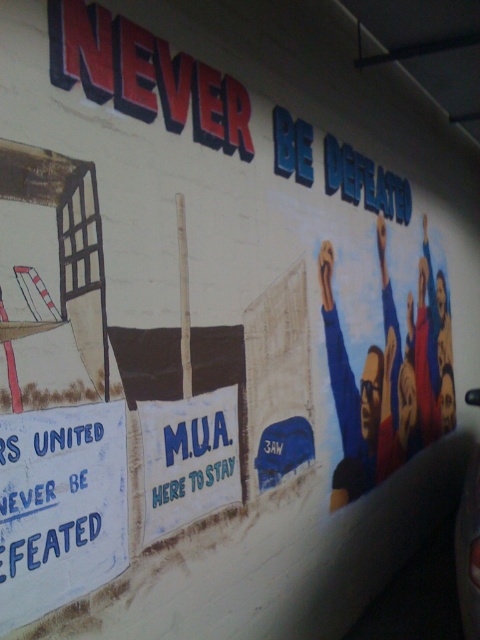
I want to click on blue painted sign at lower left, so click(x=59, y=502).

Can you confirm if blue painted sign at lower left is bigger than blue fabric sign at center?

Yes.

Which is in front, point (108, 568) or point (224, 428)?

Point (108, 568) is in front.

The image size is (480, 640). In order to click on blue painted sign at lower left in this screenshot , I will do `click(59, 502)`.